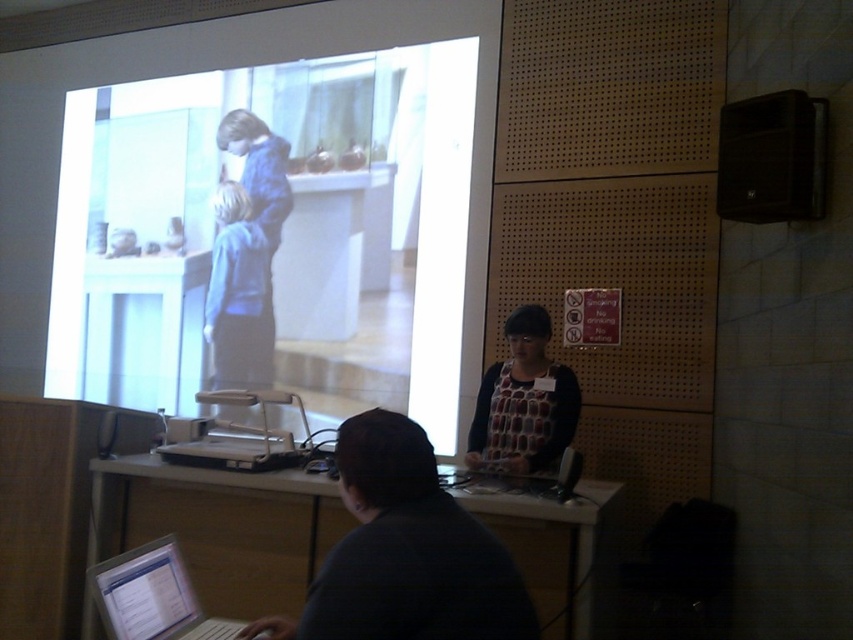
Looking at this image, you are an attendee at a presentation. You notice the white glossy screen at upper center and the polka dot blouse at center. Which object takes up more horizontal space in the image?

The white glossy screen at upper center takes up more horizontal space because its width is larger than the polka dot blouse at center.

You are a person standing in the room shown in the image. You want to place a 2.5 meter long banner on the floor between you and the white glossy table at lower center. Is the distance sufficient to lay it flat without folding?

The distance between you and the white glossy table at lower center is 2.42 meters, which is slightly shorter than the 2.5 meter banner. Therefore, the banner cannot be laid flat without folding.